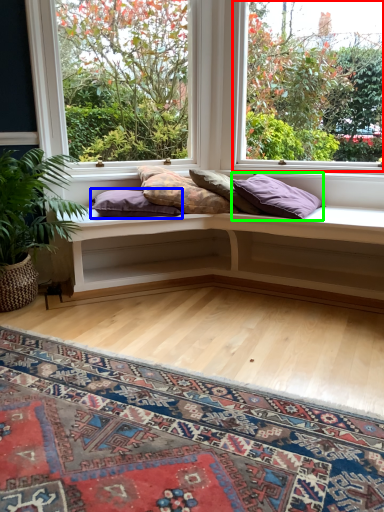
Question: Considering the real-world distances, which object is closest to window (highlighted by a red box)? pillow (highlighted by a blue box) or pillow (highlighted by a green box).

Choices:
 (A) pillow
 (B) pillow

Answer: (B)